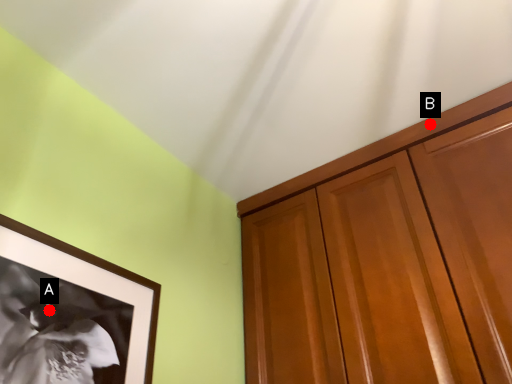
Question: Two points are circled on the image, labeled by A and B beside each circle. Which point is further to the camera?

Choices:
 (A) A is further
 (B) B is further

Answer: (B)